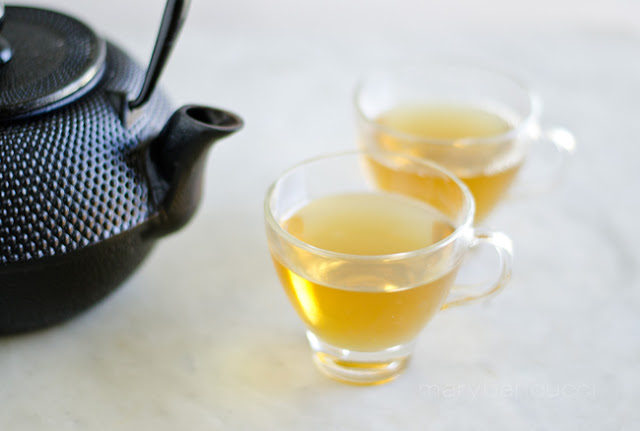
Locate an element on the screen. Image resolution: width=640 pixels, height=431 pixels. rim of cups is located at coordinates (x=365, y=116), (x=356, y=151).